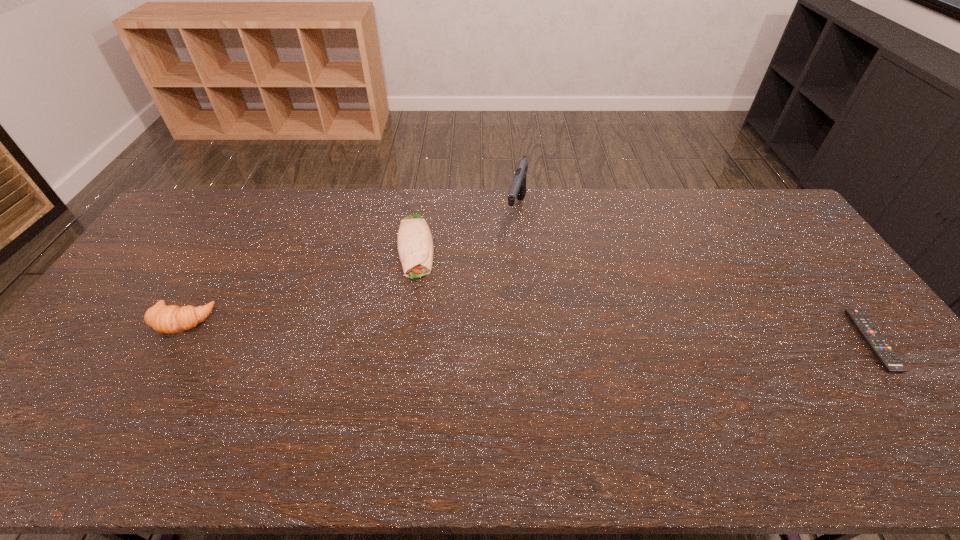
In order to click on vacant area located at the muzzle of the second object from right to left in this screenshot , I will do `click(546, 266)`.

The image size is (960, 540). I want to click on vacant area located at the muzzle of the second object from right to left, so click(x=530, y=243).

Image resolution: width=960 pixels, height=540 pixels. Identify the location of vacant space located 0.220m at the muzzle of the second object from right to left. (554, 276).

I want to click on vacant space located 0.050m at the bitten end of the burrito, so click(x=415, y=293).

Locate an element on the screen. free location located 0.300m at the bitten end of the burrito is located at coordinates (420, 363).

Image resolution: width=960 pixels, height=540 pixels. Find the location of `free space located at the bitten end of the burrito`. free space located at the bitten end of the burrito is located at coordinates (415, 293).

The width and height of the screenshot is (960, 540). I want to click on gun that is at the far edge, so click(518, 188).

Where is `burrito located at the far edge`? burrito located at the far edge is located at coordinates (415, 247).

What are the coordinates of `object that is at the left edge` in the screenshot? It's located at (172, 319).

At what (x,y) coordinates should I click in order to perform the action: click on object present at the right edge. Please return your answer as a coordinate pair (x, y). Looking at the image, I should click on [x=874, y=339].